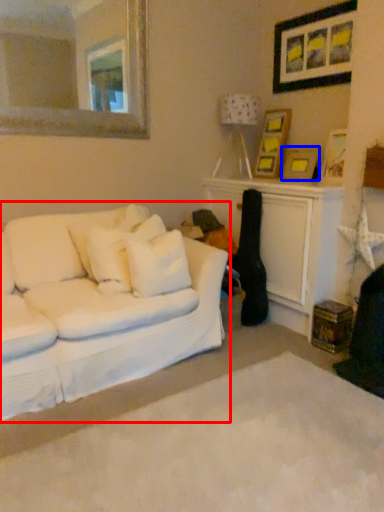
Question: Which of the following is the closest to the observer, studio couch (highlighted by a red box) or picture frame (highlighted by a blue box)?

Choices:
 (A) studio couch
 (B) picture frame

Answer: (A)